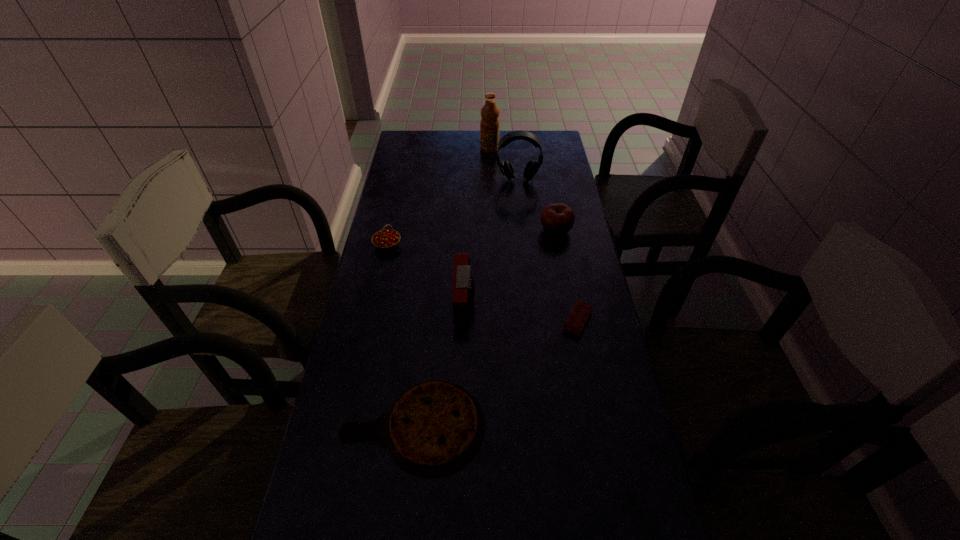
This screenshot has width=960, height=540. In order to click on free area in between the nearest object and the camera in this screenshot , I will do `click(439, 363)`.

At what (x,y) coordinates should I click in order to perform the action: click on free space between the Lego and the nearest object. Please return your answer as a coordinate pair (x, y). The width and height of the screenshot is (960, 540). Looking at the image, I should click on [495, 373].

At what (x,y) coordinates should I click in order to perform the action: click on vacant region between the pizza and the third shortest object. Please return your answer as a coordinate pair (x, y). The image size is (960, 540). Looking at the image, I should click on tap(400, 335).

Where is `empty space between the nearest object and the apple`? empty space between the nearest object and the apple is located at coordinates (484, 328).

The width and height of the screenshot is (960, 540). What are the coordinates of `vacant area between the tallest object and the Lego` in the screenshot? It's located at (534, 235).

The height and width of the screenshot is (540, 960). Identify the location of empty space between the pizza and the tallest object. (451, 287).

The width and height of the screenshot is (960, 540). Identify the location of the fourth closest object to the second farthest object. (463, 283).

This screenshot has height=540, width=960. Find the location of `object that is the third closest one to the farthest object`. object that is the third closest one to the farthest object is located at coordinates (386, 239).

Identify the location of vacant space that satisfies the following two spatial constraints: 1. on the ear cups of the sixth nearest object; 2. on the right side of the apple. Image resolution: width=960 pixels, height=540 pixels. (523, 230).

Where is `vacant region that satisfies the following two spatial constraints: 1. on the ear cups of the second tallest object; 2. on the front-facing side of the camera`? Image resolution: width=960 pixels, height=540 pixels. vacant region that satisfies the following two spatial constraints: 1. on the ear cups of the second tallest object; 2. on the front-facing side of the camera is located at coordinates (531, 301).